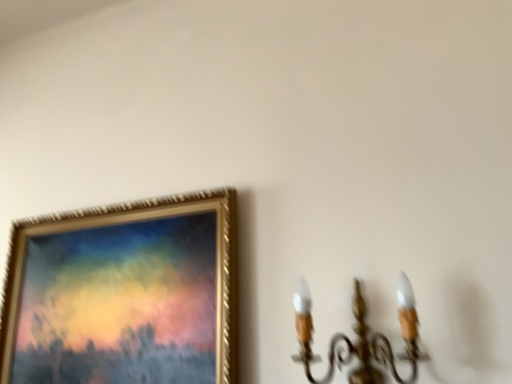
Question: Should I look upward or downward to see gold textured frame at upper left?

Choices:
 (A) up
 (B) down

Answer: (B)

Question: Can you confirm if gold metallic chandelier at right is positioned to the left of gold textured frame at upper left?

Choices:
 (A) no
 (B) yes

Answer: (A)

Question: Is gold metallic chandelier at right thinner than gold textured frame at upper left?

Choices:
 (A) no
 (B) yes

Answer: (A)

Question: From a real-world perspective, is gold metallic chandelier at right physically below gold textured frame at upper left?

Choices:
 (A) no
 (B) yes

Answer: (B)

Question: From the image's perspective, is gold metallic chandelier at right located beneath gold textured frame at upper left?

Choices:
 (A) no
 (B) yes

Answer: (A)

Question: Is gold metallic chandelier at right positioned behind gold textured frame at upper left?

Choices:
 (A) no
 (B) yes

Answer: (A)

Question: Does gold metallic chandelier at right have a smaller size compared to gold textured frame at upper left?

Choices:
 (A) yes
 (B) no

Answer: (A)

Question: Does gold textured frame at upper left come behind gold metallic chandelier at right?

Choices:
 (A) yes
 (B) no

Answer: (A)

Question: Is gold textured frame at upper left directly adjacent to gold metallic chandelier at right?

Choices:
 (A) no
 (B) yes

Answer: (A)

Question: Can you confirm if gold textured frame at upper left is thinner than gold metallic chandelier at right?

Choices:
 (A) yes
 (B) no

Answer: (A)

Question: Considering the relative sizes of gold textured frame at upper left and gold metallic chandelier at right in the image provided, is gold textured frame at upper left wider than gold metallic chandelier at right?

Choices:
 (A) no
 (B) yes

Answer: (A)

Question: Could you tell me if gold textured frame at upper left is facing gold metallic chandelier at right?

Choices:
 (A) yes
 (B) no

Answer: (B)

Question: Does gold textured frame at upper left appear on the right side of gold metallic chandelier at right?

Choices:
 (A) no
 (B) yes

Answer: (A)

Question: Is gold metallic chandelier at right situated inside gold textured frame at upper left or outside?

Choices:
 (A) outside
 (B) inside

Answer: (A)